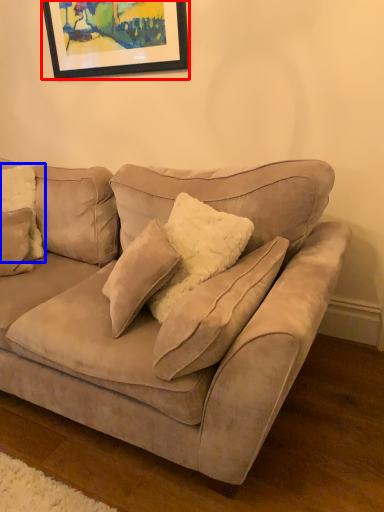
Question: Which point is further to the camera, picture frame (highlighted by a red box) or pillow (highlighted by a blue box)?

Choices:
 (A) picture frame
 (B) pillow

Answer: (A)